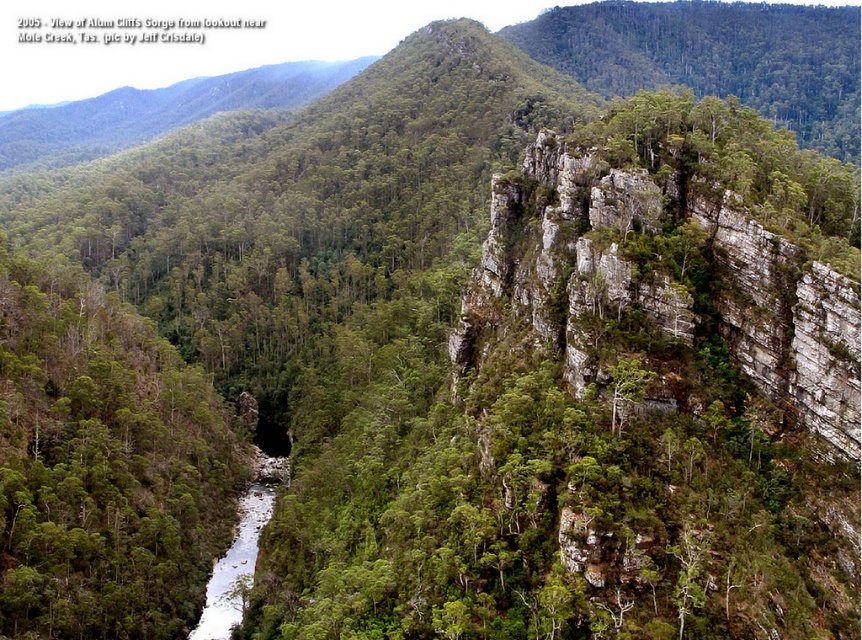
Question: Which object appears farthest from the camera in this image?

Choices:
 (A) green leafy tree at lower left
 (B) white smooth river at center

Answer: (B)

Question: Which of the following is the farthest from the observer?

Choices:
 (A) (241, 588)
 (B) (111, 500)

Answer: (A)

Question: Is green leafy tree at lower left wider than white smooth river at center?

Choices:
 (A) yes
 (B) no

Answer: (A)

Question: Which object is closer to the camera taking this photo?

Choices:
 (A) green leafy tree at lower left
 (B) white smooth river at center

Answer: (A)

Question: Observing the image, what is the correct spatial positioning of green leafy tree at lower left in reference to white smooth river at center?

Choices:
 (A) below
 (B) above

Answer: (B)

Question: Does green leafy tree at lower left have a lesser width compared to white smooth river at center?

Choices:
 (A) no
 (B) yes

Answer: (A)